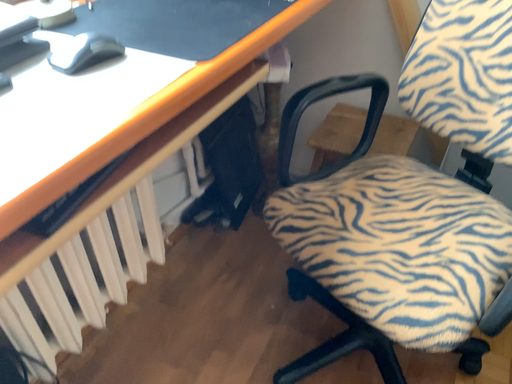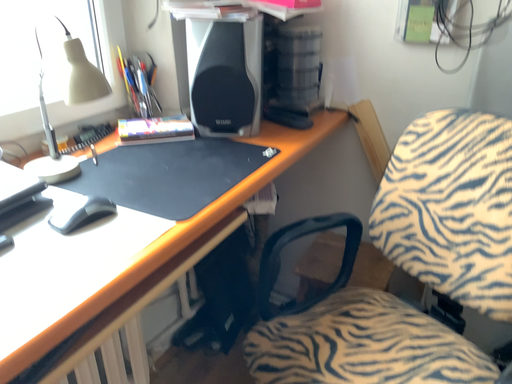
Question: How did the camera likely rotate when shooting the video?

Choices:
 (A) rotated downward
 (B) rotated upward

Answer: (B)